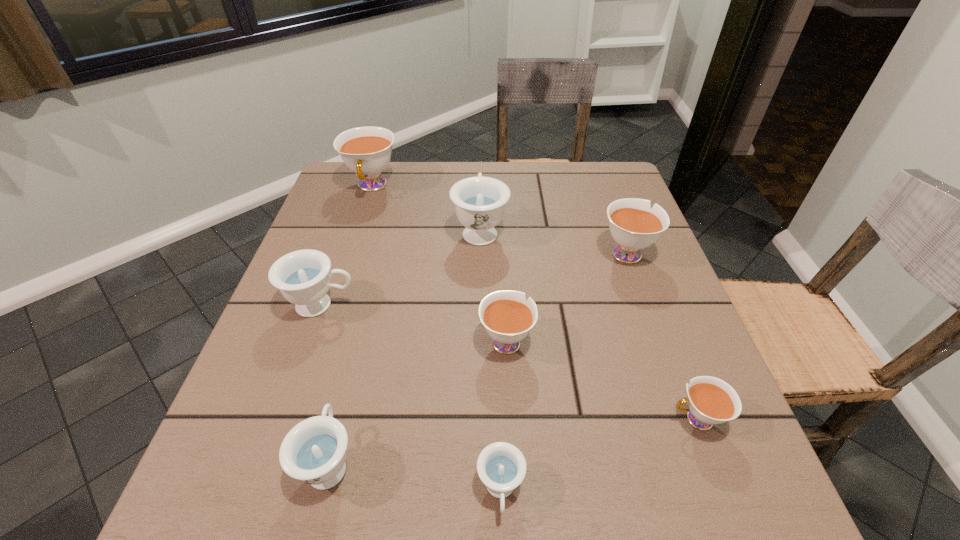
Identify which blue teacup is the nearest to the nearest white teacup. Please provide its 2D coordinates. Your answer should be formatted as a tuple, i.e. [(x, y)], where the tuple contains the x and y coordinates of a point satisfying the conditions above.

[(501, 466)]

Locate an element on the screen. The width and height of the screenshot is (960, 540). free spot that satisfies the following two spatial constraints: 1. on the side of the third smallest blue teacup with the handle; 2. on the side of the second nearest white teacup with the handle is located at coordinates (310, 340).